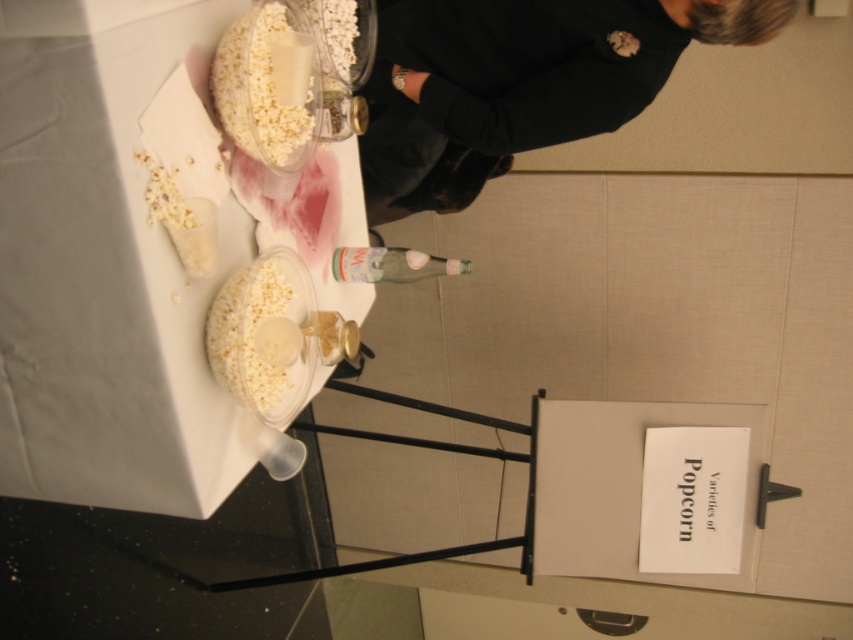
You are a caterer setting up for an event and need to place a 12 inch wide centerpiece between the black fabric at upper right and the white fluffy popcorn at center. Is there enough space?

The distance between the black fabric at upper right and the white fluffy popcorn at center is 26.08 inches, so yes, there is enough space to place a 12 inch wide centerpiece between them.

You are a guest at a party and see two white fluffy popcorn at upper center and white fluffy popcorn at center on the table. Which one is positioned more to the right?

The white fluffy popcorn at upper center is positioned more to the right than the white fluffy popcorn at center.

You are looking at the table setup and need to place a small decorative item between the two points, point (567, 26) and point (254, 284). Which point should you place it closer to in order to ensure it is nearer to the viewer?

You should place the item closer to point (567, 26) because it is further to the viewer than point (254, 284).